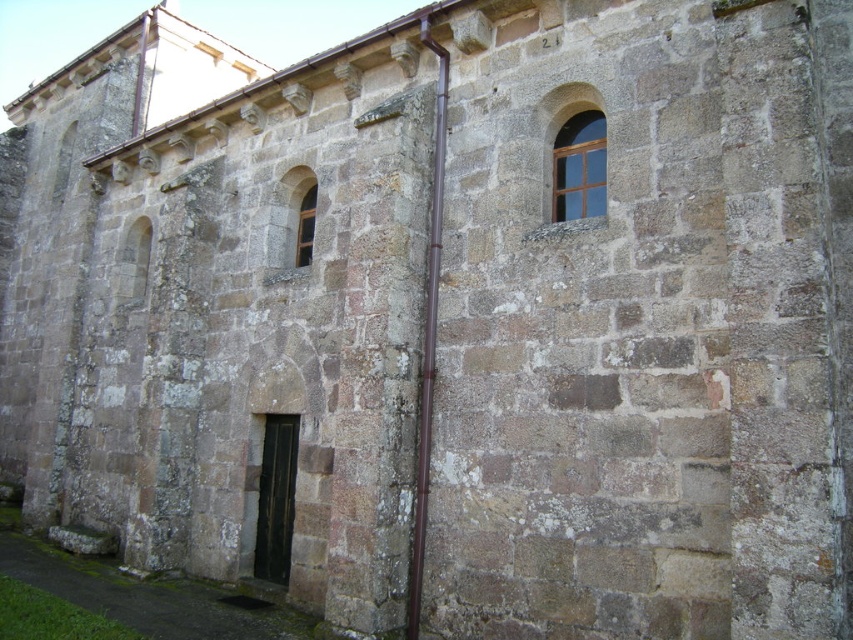
You are an architect assessing the building facade. You need to determine which window, the clear glass window at upper center or the matte stone window at center, requires more frequent cleaning due to its size. Which one would that be?

The clear glass window at upper center requires more frequent cleaning because it is larger in size than the matte stone window at center.

You are standing in front of the stone building wall and want to see the view through the clear glass window at upper center. Can you see the matte stone window at center through it?

The clear glass window at upper center is in front of the matte stone window at center, so yes, you can see the matte stone window at center through the clear glass window at upper center because it is positioned behind it.